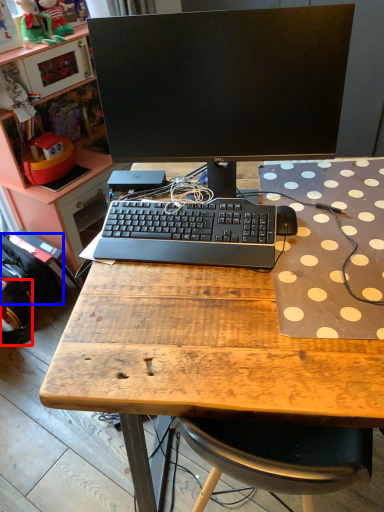
Question: Which object is closer to the camera taking this photo, backpack (highlighted by a red box) or backpack (highlighted by a blue box)?

Choices:
 (A) backpack
 (B) backpack

Answer: (A)